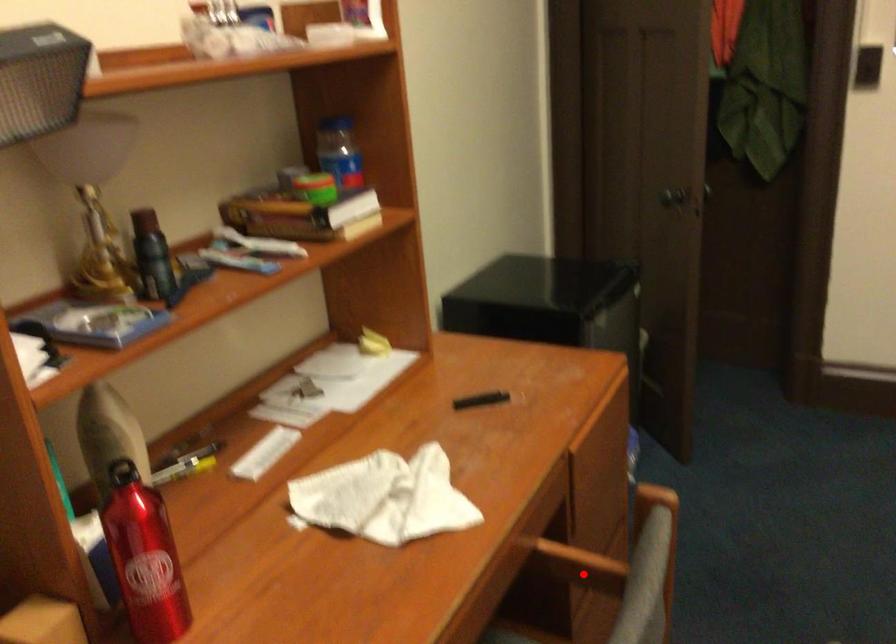
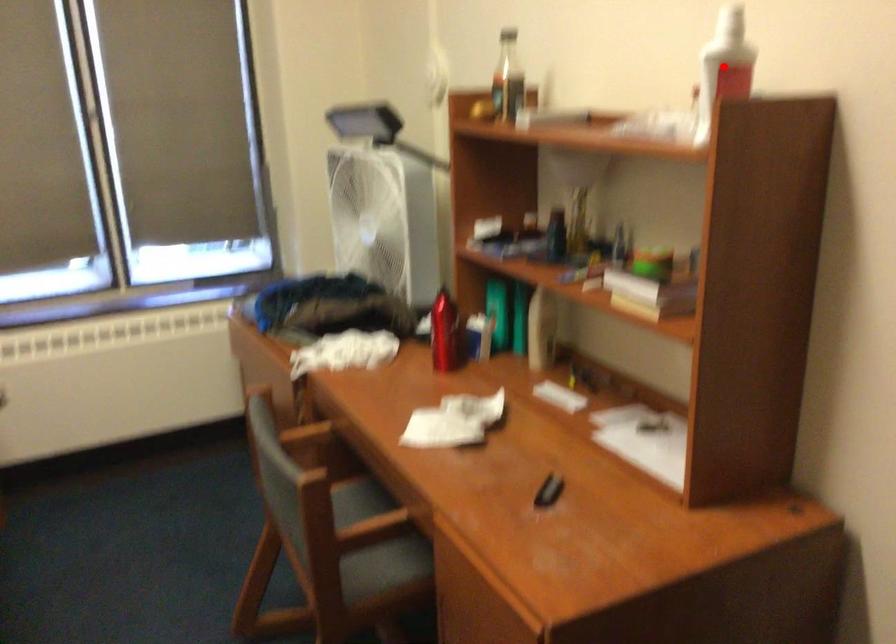
I am providing you with two images of the same scene from different viewpoints. A red point is marked on the first image and another point is marked on the second image. Is the marked point in image1 the same physical position as the marked point in image2?

No